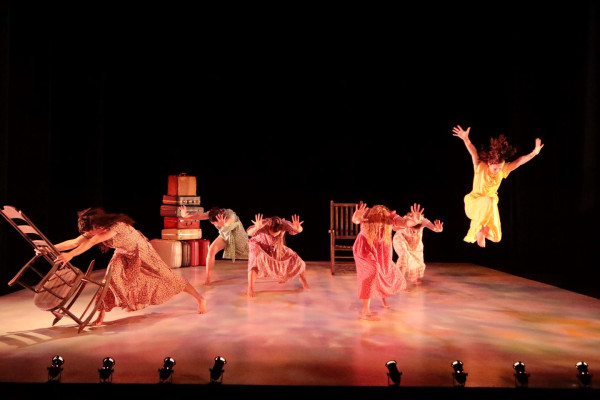
Find the location of a particular element. lights is located at coordinates (211, 374), (150, 374), (383, 386), (456, 377), (518, 379).